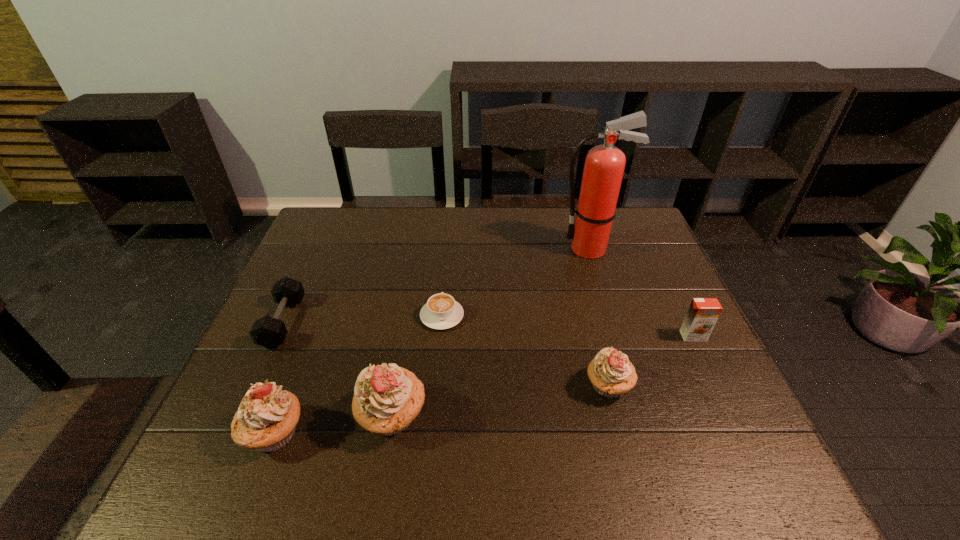
I want to click on vacant area at the right edge, so click(x=634, y=273).

This screenshot has height=540, width=960. What are the coordinates of `vacant space at the far right corner of the desktop` in the screenshot? It's located at (616, 246).

In order to click on free space at the near right corner of the desktop in this screenshot , I will do `click(677, 417)`.

Find the location of a particular element. Image resolution: width=960 pixels, height=540 pixels. vacant space that's between the cappuccino and the second cupcake from right to left is located at coordinates (418, 366).

Identify the location of free space between the second shortest object and the second cupcake from left to right. (338, 369).

Identify the location of unoccupied position between the shortest cupcake and the shortest object. (525, 351).

The width and height of the screenshot is (960, 540). Find the location of `vacant space in between the fifth shortest object and the second cupcake from right to left`. vacant space in between the fifth shortest object and the second cupcake from right to left is located at coordinates (333, 424).

Locate an element on the screen. Image resolution: width=960 pixels, height=540 pixels. vacant region between the rightmost object and the third tallest object is located at coordinates (484, 384).

Locate an element on the screen. The width and height of the screenshot is (960, 540). free space between the cappuccino and the leftmost cupcake is located at coordinates (358, 374).

At what (x,y) coordinates should I click in order to perform the action: click on free space that is in between the tallest object and the shortest cupcake. Please return your answer as a coordinate pair (x, y). Looking at the image, I should click on (599, 317).